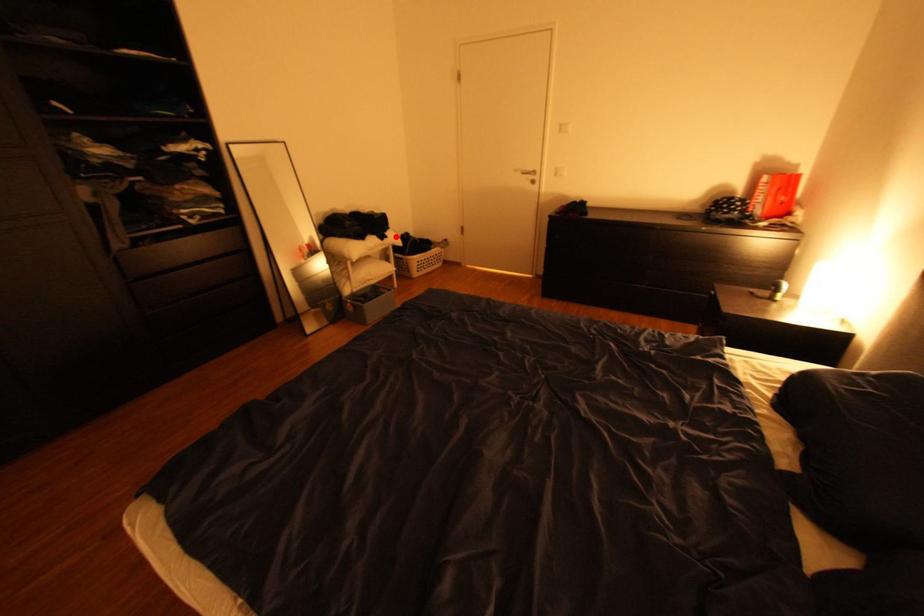
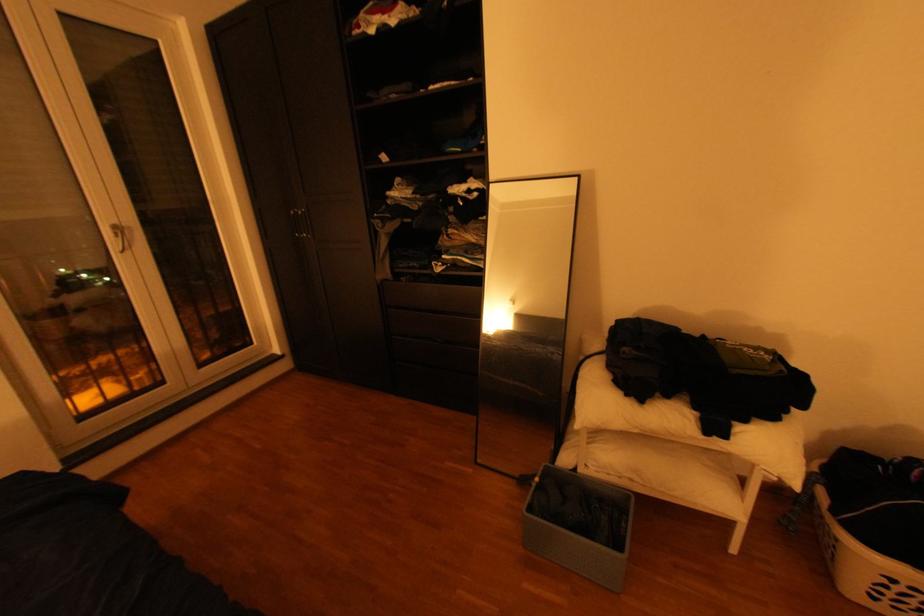
Question: I am providing you with two images of the same scene from different viewpoints. Image1 has a red point marked. In image2, the corresponding 3D location appears at what relative position? Reply with the corresponding letter.

Choices:
 (A) Closer
 (B) Farther

Answer: (B)